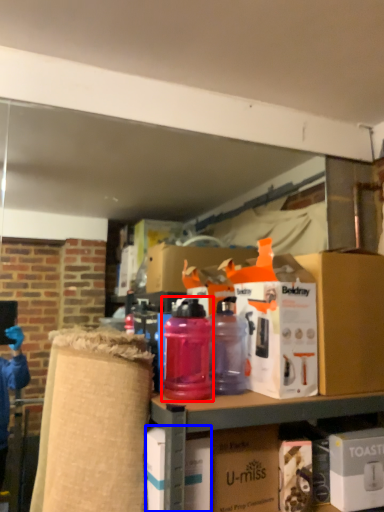
Question: Which point is further to the camera, bottle (highlighted by a red box) or box (highlighted by a blue box)?

Choices:
 (A) bottle
 (B) box

Answer: (A)